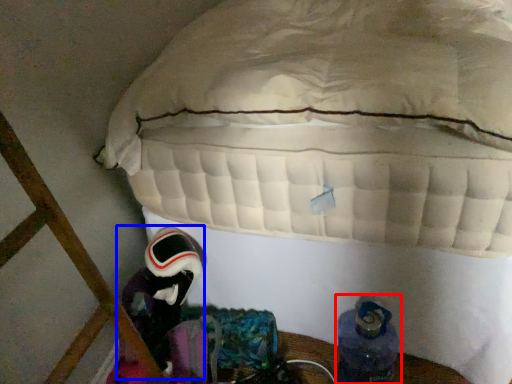
Question: Which point is closer to the camera, footwear (highlighted by a red box) or astronaut (highlighted by a blue box)?

Choices:
 (A) footwear
 (B) astronaut

Answer: (A)